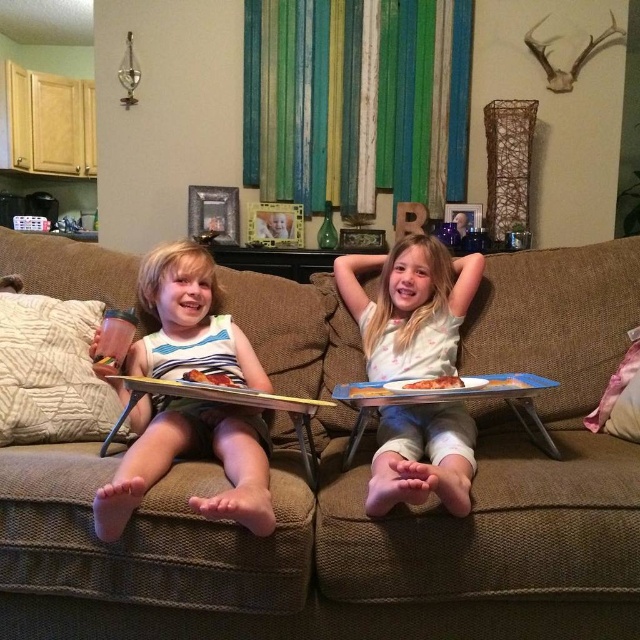
You are a photographer trying to capture a clear shot of both the white cotton shirt at center and the wooden tray at left without any obstruction. Based on their positions, which object should you focus on first to ensure it appears in the foreground of the photo?

The white cotton shirt at center is in front of the wooden tray at left, so you should focus on the white cotton shirt at center first to ensure it appears in the foreground.

You are a parent trying to pack a bag for a picnic. You have both the matte white tank top at left and the white cotton shirt at center. Which one should you choose if you want the clothing item that is wider?

The matte white tank top at left is wider than the white cotton shirt at center, so you should choose the matte white tank top at left for the picnic.

You are a parent trying to decide which item to clean first. The white cotton shirt at center and the wooden tray at left are both in need of cleaning. Based on their sizes, which item should you pick up first if you want to handle the larger one first?

The white cotton shirt at center is larger in size than the wooden tray at left, so you should pick up the white cotton shirt at center first.